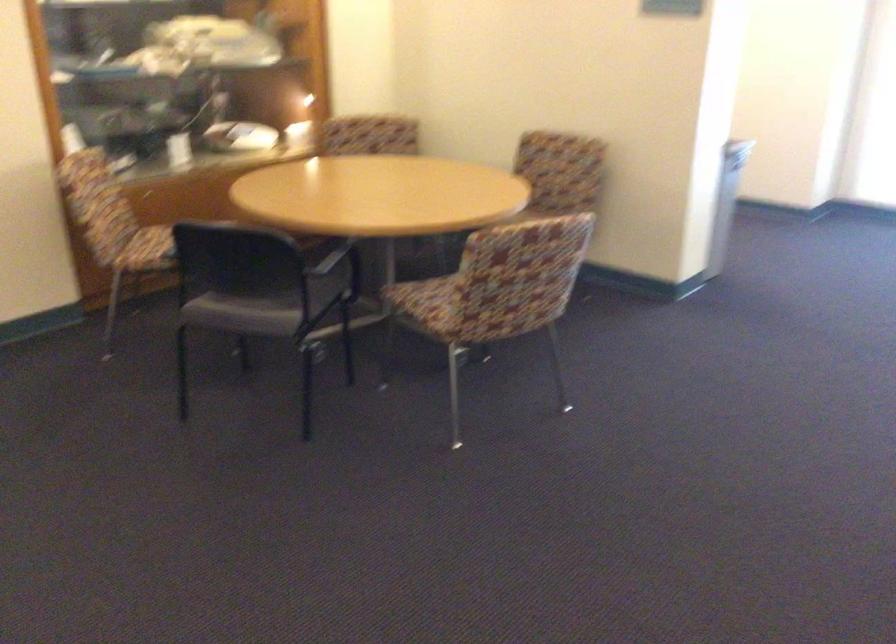
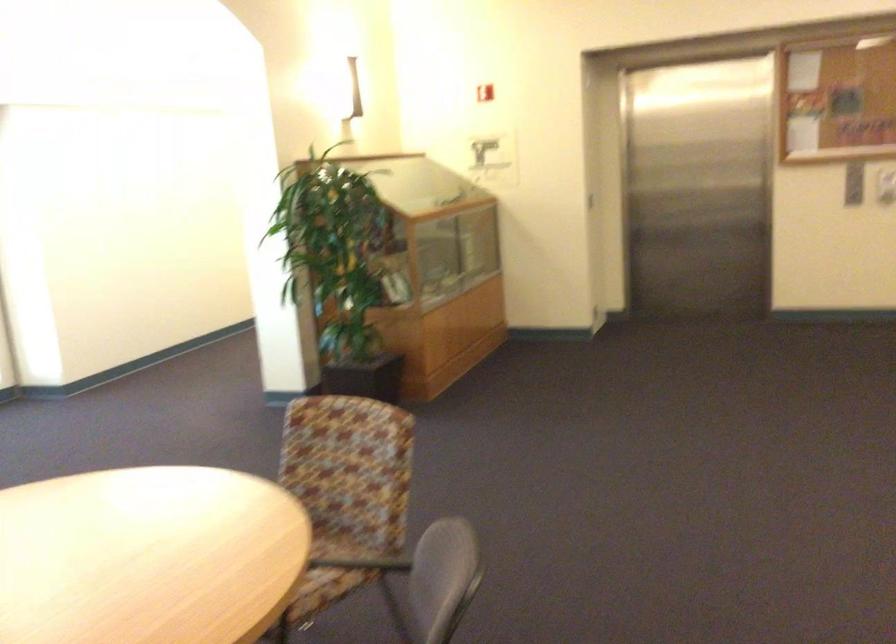
Question: I am providing you with two images of the same scene from different viewpoints. Please identify which objects are invisible in image2.

Choices:
 (A) grey chair sitting surface
 (B) red fire alarm
 (C) patterned chair sitting surface
 (D) none of these

Answer: (D)